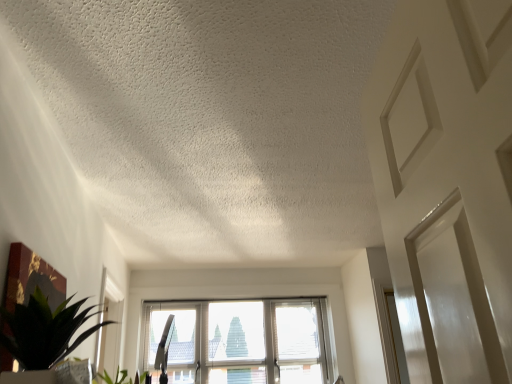
Question: Considering the relative sizes of green leafy plant at lower left and transparent glass window at center in the image provided, is green leafy plant at lower left taller than transparent glass window at center?

Choices:
 (A) no
 (B) yes

Answer: (A)

Question: From the image's perspective, would you say green leafy plant at lower left is shown under transparent glass window at center?

Choices:
 (A) yes
 (B) no

Answer: (B)

Question: Is green leafy plant at lower left looking in the opposite direction of transparent glass window at center?

Choices:
 (A) no
 (B) yes

Answer: (A)

Question: Is green leafy plant at lower left facing towards transparent glass window at center?

Choices:
 (A) yes
 (B) no

Answer: (B)

Question: Is green leafy plant at lower left outside transparent glass window at center?

Choices:
 (A) no
 (B) yes

Answer: (B)

Question: Is green leafy plant at lower left to the right of transparent glass window at center from the viewer's perspective?

Choices:
 (A) yes
 (B) no

Answer: (B)

Question: Is the surface of transparent glass window at center in direct contact with green leafy plant at lower left?

Choices:
 (A) no
 (B) yes

Answer: (A)

Question: From the image's perspective, would you say transparent glass window at center is shown under green leafy plant at lower left?

Choices:
 (A) no
 (B) yes

Answer: (B)

Question: Considering the relative sizes of transparent glass window at center and green leafy plant at lower left in the image provided, is transparent glass window at center shorter than green leafy plant at lower left?

Choices:
 (A) no
 (B) yes

Answer: (A)

Question: Is green leafy plant at lower left at the back of transparent glass window at center?

Choices:
 (A) yes
 (B) no

Answer: (B)

Question: Considering the relative sizes of transparent glass window at center and green leafy plant at lower left in the image provided, is transparent glass window at center taller than green leafy plant at lower left?

Choices:
 (A) no
 (B) yes

Answer: (B)

Question: Is transparent glass window at center completely or partially outside of green leafy plant at lower left?

Choices:
 (A) yes
 (B) no

Answer: (A)

Question: Do you think transparent glass window at center is within green leafy plant at lower left, or outside of it?

Choices:
 (A) inside
 (B) outside

Answer: (B)